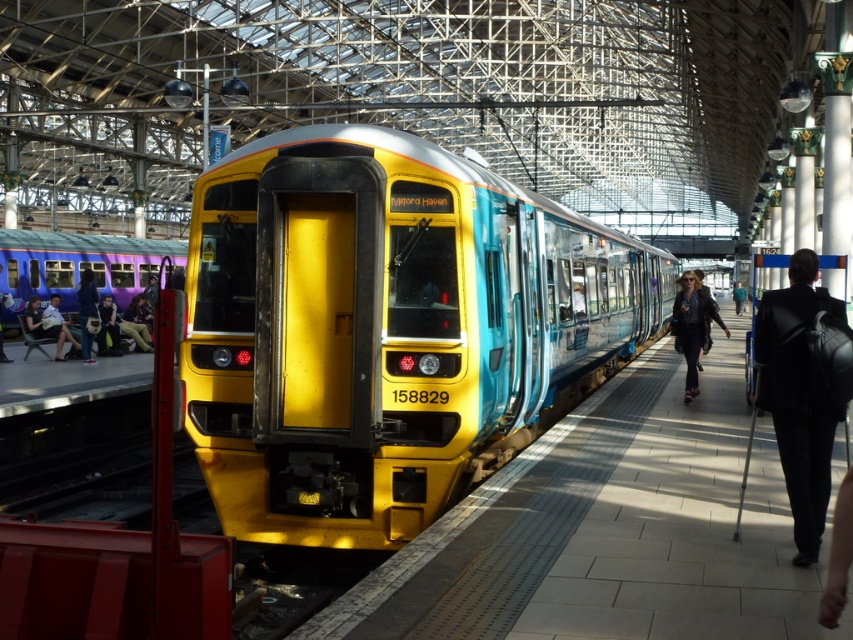
Does dark suit at right lie in front of matte black jacket at left?

That is True.

Between dark suit at right and matte black jacket at left, which one appears on the left side from the viewer's perspective?

matte black jacket at left

Between point (758, 314) and point (64, 337), which one is positioned in front?

Point (758, 314)

The height and width of the screenshot is (640, 853). What are the coordinates of `dark suit at right` in the screenshot? It's located at (801, 392).

Based on the photo, does leather jacket at center appear over denim jacket at left?

Yes.

I want to click on leather jacket at center, so click(x=692, y=324).

Is point (692, 323) farther from camera compared to point (84, 291)?

No, (692, 323) is in front of (84, 291).

Find the location of `leather jacket at center`. leather jacket at center is located at coordinates (692, 324).

Is point (271, 369) farther from viewer compared to point (97, 312)?

No, (271, 369) is closer to viewer.

Looking at this image, can you confirm if yellow matte train at center is positioned above denim jacket at left?

Indeed, yellow matte train at center is positioned over denim jacket at left.

This screenshot has width=853, height=640. I want to click on yellow matte train at center, so click(x=386, y=328).